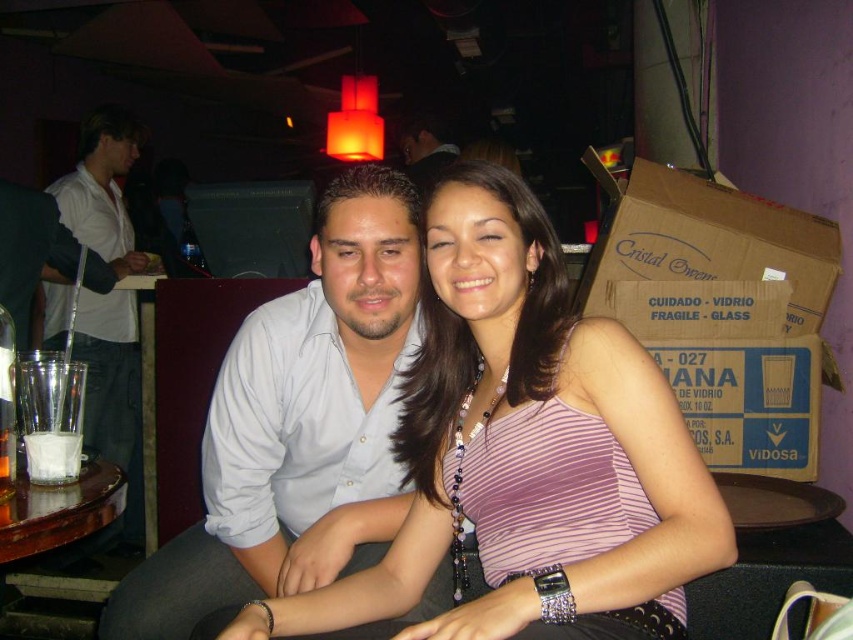
Question: Does purple striped tank top at center appear on the left side of white shirt at left?

Choices:
 (A) no
 (B) yes

Answer: (A)

Question: Does white shirt at left appear on the right side of matte white shirt at center?

Choices:
 (A) no
 (B) yes

Answer: (A)

Question: Which point appears farthest from the camera in this image?

Choices:
 (A) (119, 428)
 (B) (427, 120)
 (C) (352, 196)

Answer: (B)

Question: Among these objects, which one is nearest to the camera?

Choices:
 (A) white shirt at center
 (B) purple striped tank top at center
 (C) white shirt at left

Answer: (B)

Question: Which of the following is the closest to the observer?

Choices:
 (A) matte white shirt at center
 (B) white shirt at center
 (C) purple striped tank top at center

Answer: (C)

Question: Is purple striped tank top at center below white shirt at center?

Choices:
 (A) no
 (B) yes

Answer: (A)